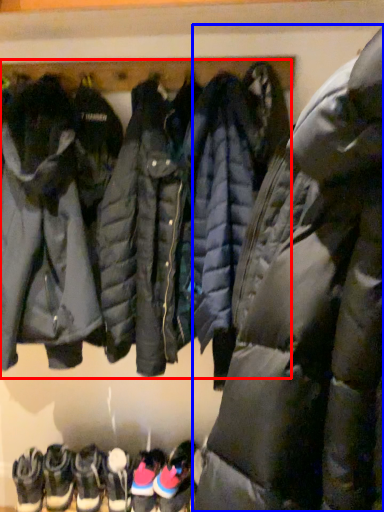
Question: Among these objects, which one is nearest to the camera, sweatshirt (highlighted by a red box) or jacket (highlighted by a blue box)?

Choices:
 (A) sweatshirt
 (B) jacket

Answer: (B)